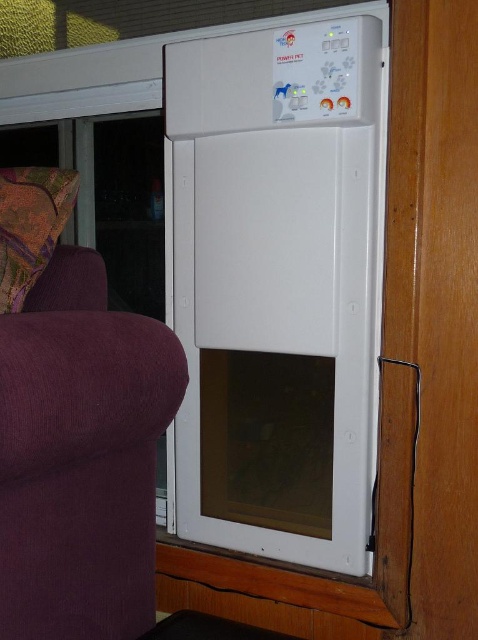
Question: Which object is farther from the camera taking this photo?

Choices:
 (A) purple fabric couch at left
 (B) multicolored fabric pillow at left

Answer: (B)

Question: Among these points, which one is farthest from the camera?

Choices:
 (A) (21, 285)
 (B) (201, 467)

Answer: (B)

Question: In this image, where is purple fabric couch at left located relative to multicolored fabric pillow at left?

Choices:
 (A) above
 (B) below

Answer: (B)

Question: Which of the following is the farthest from the observer?

Choices:
 (A) (111, 636)
 (B) (77, 180)

Answer: (B)

Question: Does white plastic pet door at center have a smaller size compared to multicolored fabric pillow at left?

Choices:
 (A) yes
 (B) no

Answer: (B)

Question: From the image, what is the correct spatial relationship of white plastic pet door at center in relation to purple fabric couch at left?

Choices:
 (A) above
 (B) below

Answer: (A)